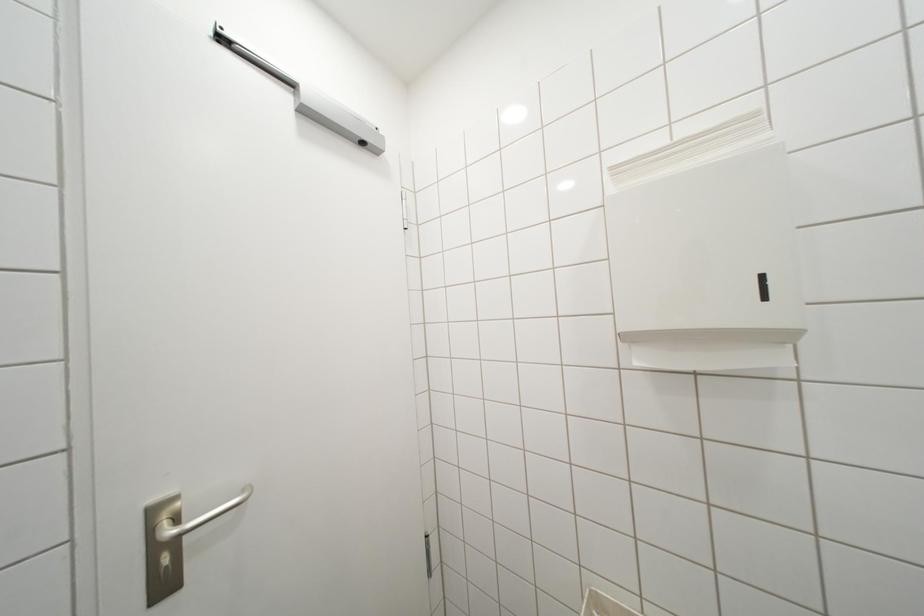
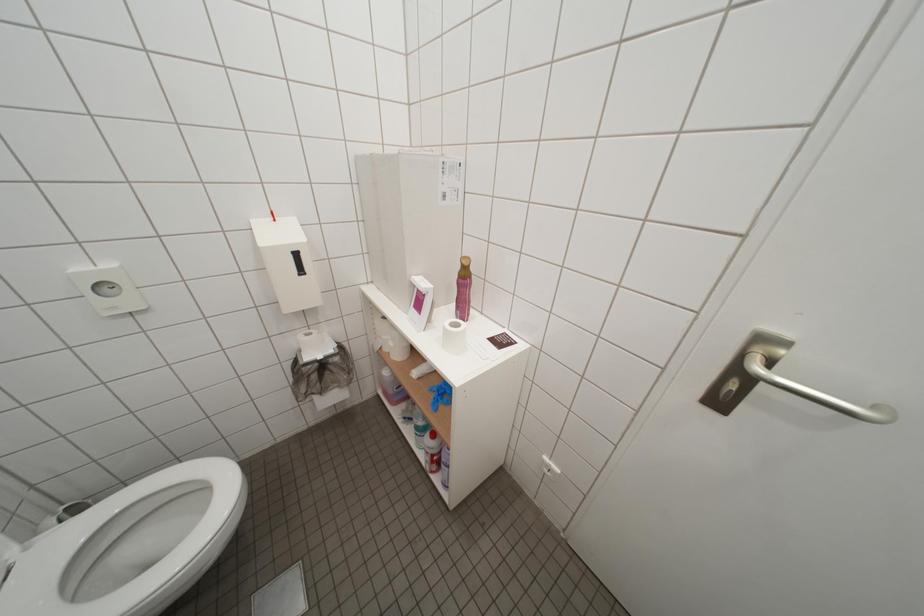
The first image is from the beginning of the video and the second image is from the end. How did the camera likely rotate when shooting the video?

The camera rotated toward left-down.